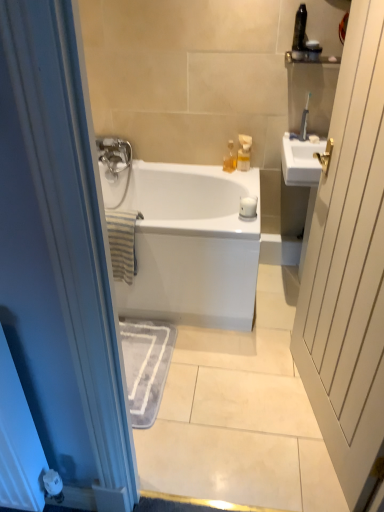
Question: Relative to translucent plastic bottle at upper center, which is the 5th toiletry from right to left, is translucent plastic soap dispenser at upper center, which ranks as the 4th toiletry in right-to-left order, in front or behind?

Choices:
 (A) front
 (B) behind

Answer: (A)

Question: Is translucent plastic soap dispenser at upper center, acting as the second toiletry starting from the left, spatially inside translucent plastic bottle at upper center, which is the 5th toiletry from right to left, or outside of it?

Choices:
 (A) outside
 (B) inside

Answer: (A)

Question: Estimate the real-world distances between objects in this image. Which object is closer to the black plastic toothbrush at upper right, arranged as the 3th toiletry when viewed from the right?

Choices:
 (A) translucent plastic soap dispenser at upper center, acting as the second toiletry starting from the left
 (B) translucent plastic container at upper right, arranged as the fourth toiletry when viewed from the left
 (C) white glossy bathtub at center
 (D) translucent plastic bottle at upper center, which is the 5th toiletry from right to left
 (E) metallic gray toothbrush at upper right, which is the fifth toiletry from left to right

Answer: (B)

Question: Considering the real-world distances, which object is farthest from the metallic gray toothbrush at upper right, which is the 1th toiletry from right to left?

Choices:
 (A) translucent plastic container at upper right, which appears as the 2th toiletry when viewed from the right
 (B) white glossy bathtub at center
 (C) translucent plastic soap dispenser at upper center, which ranks as the 4th toiletry in right-to-left order
 (D) black plastic toothbrush at upper right, arranged as the 3th toiletry when viewed from the right
 (E) translucent plastic bottle at upper center, which is the 5th toiletry from right to left

Answer: (B)